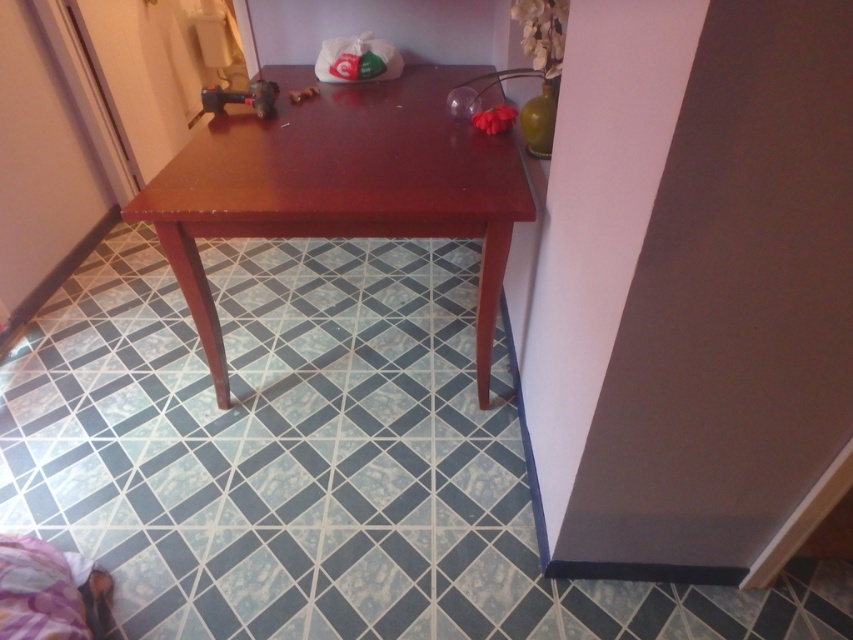
Is point (490, 163) behind point (508, 115)?

No, (490, 163) is closer to viewer.

Who is positioned more to the right, matte wood table at center or transparent glass lamp at upper center?

Positioned to the right is transparent glass lamp at upper center.

Locate an element on the screen. Image resolution: width=853 pixels, height=640 pixels. matte wood table at center is located at coordinates (341, 188).

Is matte wood table at center closer to the viewer compared to metallic plastic toy at center?

Yes.

Measure the distance from matte wood table at center to metallic plastic toy at center.

matte wood table at center and metallic plastic toy at center are 20.53 inches apart from each other.

Who is more distant from viewer, (199,268) or (305,99)?

The point (305,99) is behind.

Image resolution: width=853 pixels, height=640 pixels. Identify the location of matte wood table at center. (x=341, y=188).

What do you see at coordinates (314, 460) in the screenshot?
I see `patterned tile at center` at bounding box center [314, 460].

Is patterned tile at center above metallic plastic toy at center?

No.

What are the coordinates of `patterned tile at center` in the screenshot? It's located at (314, 460).

This screenshot has height=640, width=853. Identify the location of patterned tile at center. click(x=314, y=460).